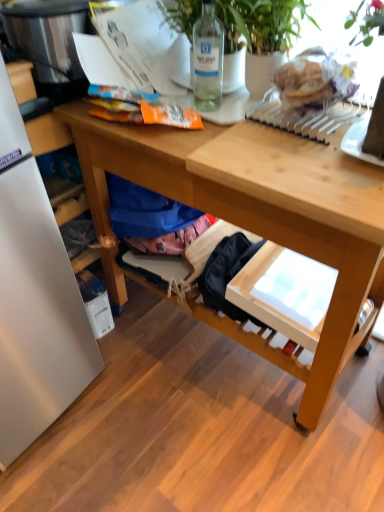
Find the location of a particular element. free location in front of wooden desk at center is located at coordinates (223, 453).